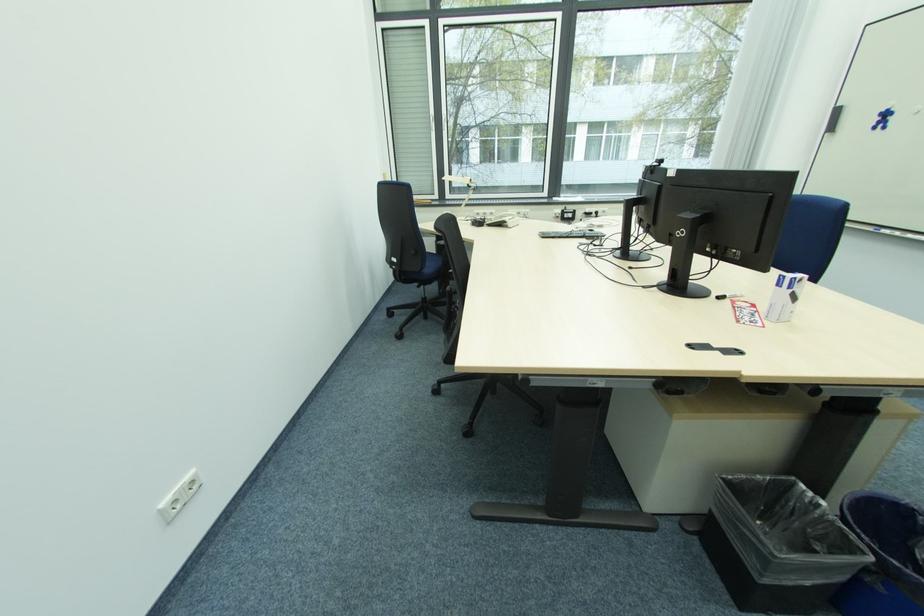
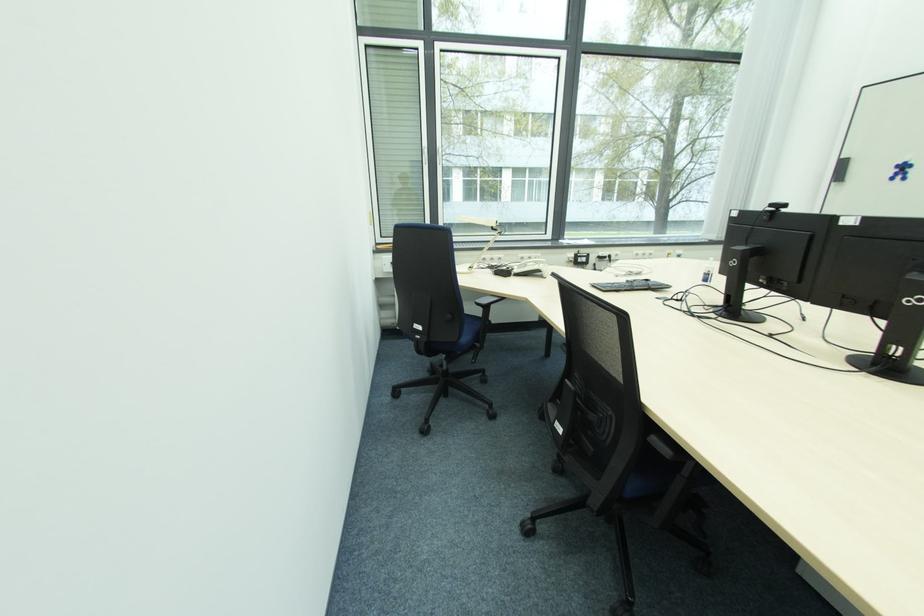
Which direction would the cameraman need to move to produce the second image?

The cameraman walked toward left, forward.